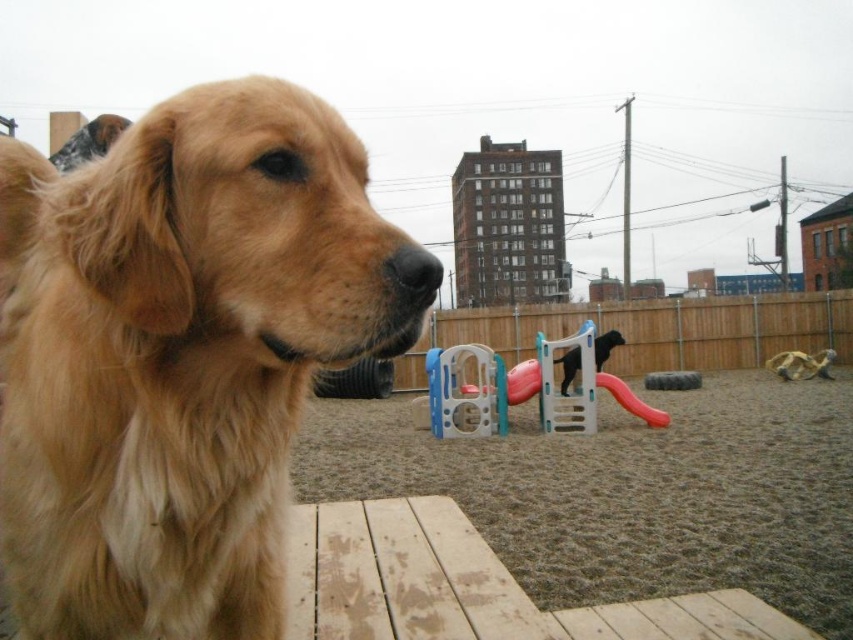
What is the exact coordinate of the brown gravel at center?

The brown gravel at center is located at point [634,492].

You are a dog owner trying to decide if your dog can walk between the golden fur dog at left and the plastic slide at center. Based on their widths, can your dog fit through the space between them?

The golden fur dog at left is wider than the plastic slide at center, so the space between them may be too narrow for your dog to comfortably pass through.

You are a dog trainer observing the golden fur dog at left and the black dog in the background. How far apart are they?

The golden fur dog at left and the black dog in the background are 25.57 inches apart.